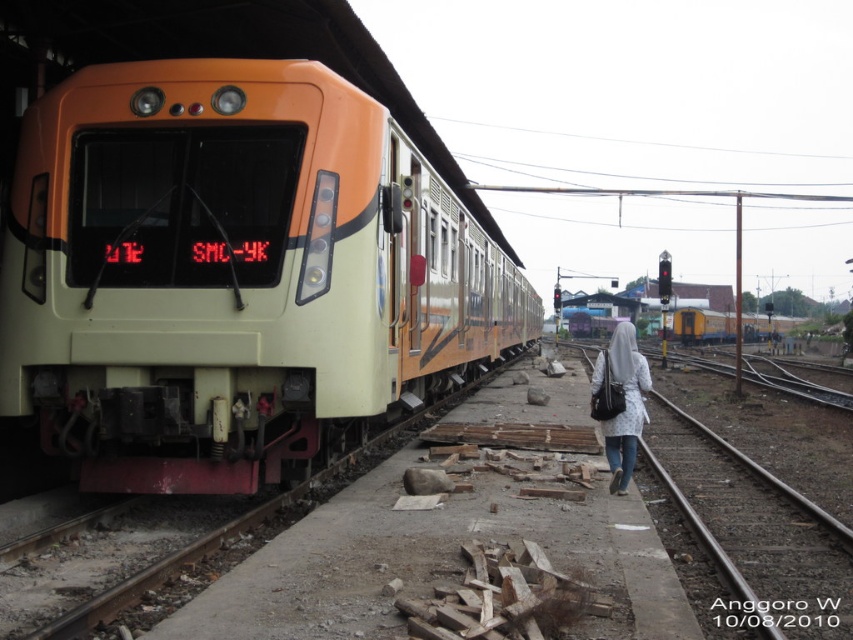
Identify the location of orange matte train at center. (234, 275).

Between orange matte train at center and white textured coat at center, which one has more height?

orange matte train at center is taller.

Which is in front, point (357, 432) or point (595, 378)?

Positioned in front is point (595, 378).

You are a GUI agent. You are given a task and a screenshot of the screen. Output one action in this format:
    pyautogui.click(x=<x>, y=<y>)
    Task: Click on the orange matte train at center
    
    Given the screenshot: What is the action you would take?
    pyautogui.click(x=234, y=275)

Can you confirm if brown gravel train track at lower right is positioned to the left of white textured coat at center?

No, brown gravel train track at lower right is not to the left of white textured coat at center.

Is the position of brown gravel train track at lower right less distant than that of white textured coat at center?

Yes, brown gravel train track at lower right is in front of white textured coat at center.

This screenshot has height=640, width=853. In order to click on brown gravel train track at lower right in this screenshot , I will do `click(759, 531)`.

Where is `brown gravel train track at lower right`? brown gravel train track at lower right is located at coordinates (759, 531).

Between orange matte train at center and brown gravel train track at lower right, which one appears on the left side from the viewer's perspective?

From the viewer's perspective, orange matte train at center appears more on the left side.

Where is `orange matte train at center`? This screenshot has width=853, height=640. orange matte train at center is located at coordinates (234, 275).